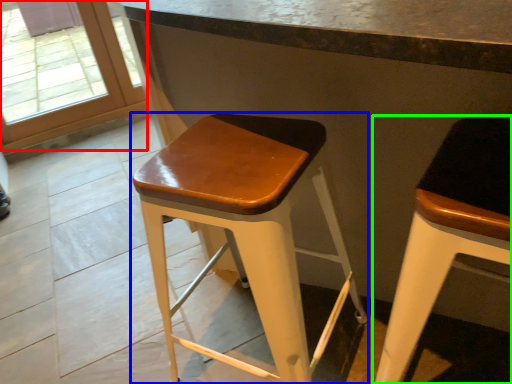
Question: Estimate the real-world distances between objects in this image. Which object is closer to glass door (highlighted by a red box), stool (highlighted by a blue box) or stool (highlighted by a green box)?

Choices:
 (A) stool
 (B) stool

Answer: (A)